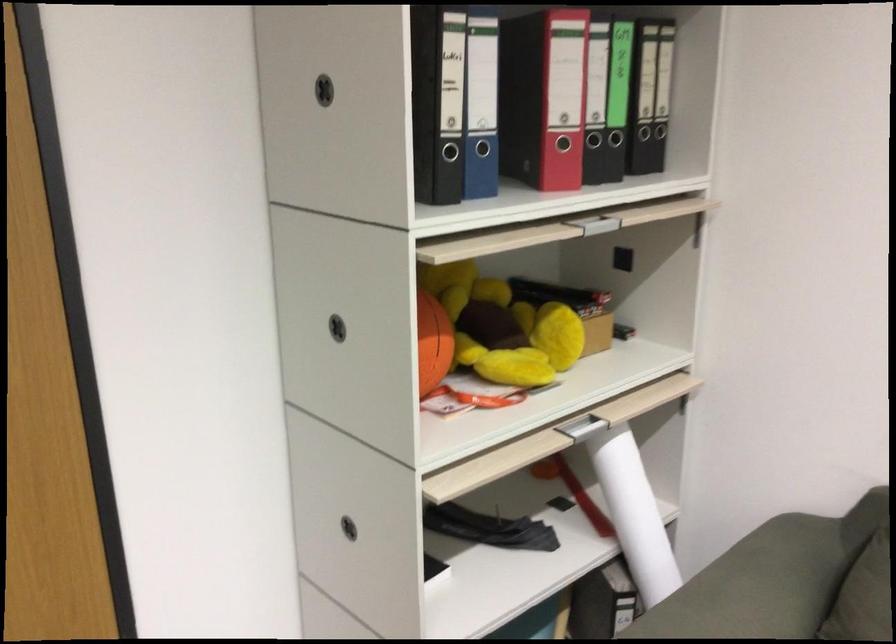
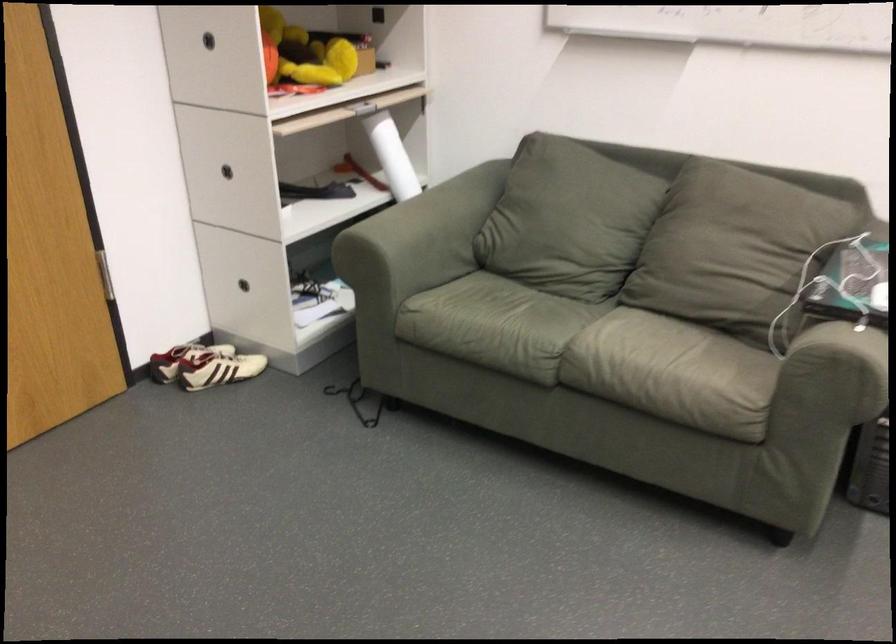
Question: Which direction would the cameraman need to move to produce the second image? Reply with the corresponding letter.

Choices:
 (A) Left
 (B) Right
 (C) Forward
 (D) Backward

Answer: (D)